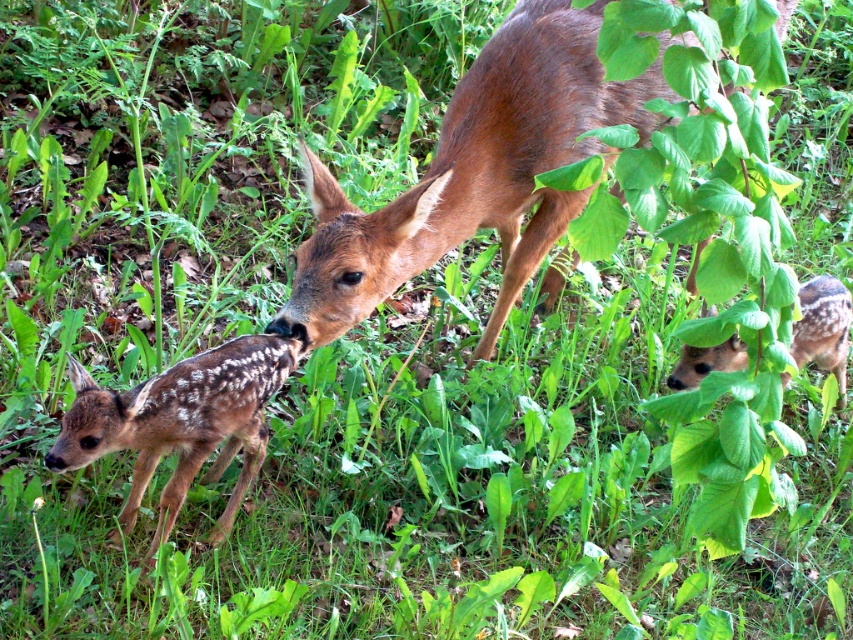
Can you confirm if brown furry deer at center is positioned to the right of brown speckled fawn at lower left?

Indeed, brown furry deer at center is positioned on the right side of brown speckled fawn at lower left.

Who is more forward, (459, 92) or (280, 352)?

Positioned in front is point (280, 352).

This screenshot has height=640, width=853. I want to click on brown furry deer at center, so click(x=474, y=173).